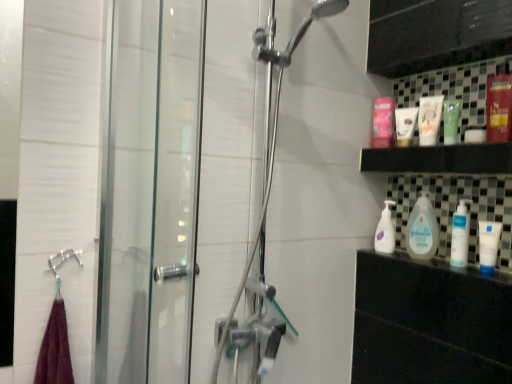
The width and height of the screenshot is (512, 384). Describe the element at coordinates (499, 107) in the screenshot. I see `metallic red mouthwash at upper right, arranged as the 1th mouthwash when viewed from the front` at that location.

The width and height of the screenshot is (512, 384). Identify the location of metallic red mouthwash at upper right, the fourth mouthwash in the back-to-front sequence. (499, 107).

Measure the distance between point (411, 109) and camera.

They are 4.66 feet apart.

The width and height of the screenshot is (512, 384). What do you see at coordinates (422, 229) in the screenshot? I see `white glossy baby lotion at center, positioned as the second cleaning product in front-to-back order` at bounding box center [422, 229].

What do you see at coordinates (385, 231) in the screenshot?
I see `white glossy mouthwash at right, the 2th mouthwash from the left` at bounding box center [385, 231].

Locate an element on the screen. white matte tube at right is located at coordinates [x=488, y=245].

What do you see at coordinates (460, 235) in the screenshot?
I see `white plastic pump bottle at lower right, which appears as the 1th cleaning product when viewed from the front` at bounding box center [460, 235].

Locate an element on the screen. Image resolution: width=512 pixels, height=384 pixels. metallic red mouthwash at upper right, arranged as the 4th mouthwash when viewed from the left is located at coordinates (499, 107).

Is white plastic pump bottle at lower right, the 2th cleaning product positioned from the back, wider than matte white lotion at upper right, arranged as the 2th toiletry when viewed from the back?

No, white plastic pump bottle at lower right, the 2th cleaning product positioned from the back, is not wider than matte white lotion at upper right, arranged as the 2th toiletry when viewed from the back.

Is white plastic pump bottle at lower right, the 2th cleaning product positioned from the back, positioned beyond the bounds of matte white lotion at upper right, arranged as the 2th toiletry when viewed from the back?

Yes, white plastic pump bottle at lower right, the 2th cleaning product positioned from the back, is outside of matte white lotion at upper right, arranged as the 2th toiletry when viewed from the back.

Based on the photo, from their relative heights in the image, would you say white plastic pump bottle at lower right, the 2th cleaning product positioned from the back, is taller or shorter than matte white lotion at upper right, which is the first toiletry from front to back?

Clearly, white plastic pump bottle at lower right, the 2th cleaning product positioned from the back, is taller compared to matte white lotion at upper right, which is the first toiletry from front to back.

How different are the orientations of white plastic pump bottle at lower right, which appears as the 1th cleaning product when viewed from the front, and matte white lotion at upper right, which is the first toiletry from front to back, in degrees?

The angular difference between white plastic pump bottle at lower right, which appears as the 1th cleaning product when viewed from the front, and matte white lotion at upper right, which is the first toiletry from front to back, is 0.00176 degrees.

Is white matte tube at right not within metallic red mouthwash at upper right, arranged as the 1th mouthwash when viewed from the front?

That's correct, white matte tube at right is outside of metallic red mouthwash at upper right, arranged as the 1th mouthwash when viewed from the front.

What's the angular difference between white matte tube at right and metallic red mouthwash at upper right, the first mouthwash positioned from the right,'s facing directions?

There is a 0.0035-degree angle between the facing directions of white matte tube at right and metallic red mouthwash at upper right, the first mouthwash positioned from the right.

From the picture: Is white matte tube at right to the left of metallic red mouthwash at upper right, arranged as the 4th mouthwash when viewed from the left, from the viewer's perspective?

Correct, you'll find white matte tube at right to the left of metallic red mouthwash at upper right, arranged as the 4th mouthwash when viewed from the left.

From a real-world perspective, which is physically above, white matte tube at right or metallic red mouthwash at upper right, the fourth mouthwash in the back-to-front sequence?

metallic red mouthwash at upper right, the fourth mouthwash in the back-to-front sequence, is physically above.

Which object is wider, white matte tube at right or white glossy baby lotion at center, which appears as the first cleaning product when viewed from the back?

white glossy baby lotion at center, which appears as the first cleaning product when viewed from the back, is wider.

From the image's perspective, who appears lower, white matte tube at right or white glossy baby lotion at center, which appears as the first cleaning product when viewed from the back?

white matte tube at right.

From a real-world perspective, which is physically above, white matte tube at right or white glossy baby lotion at center, positioned as the second cleaning product in front-to-back order?

white glossy baby lotion at center, positioned as the second cleaning product in front-to-back order, is physically above.

Can you tell me how much white matte tube at right and white glossy baby lotion at center, which appears as the first cleaning product when viewed from the back, differ in facing direction?

0.00129 degrees separate the facing orientations of white matte tube at right and white glossy baby lotion at center, which appears as the first cleaning product when viewed from the back.

Between white matte tube at right and white glossy mouthwash at right, the second mouthwash in the back-to-front sequence, which one appears on the left side from the viewer's perspective?

white glossy mouthwash at right, the second mouthwash in the back-to-front sequence.

Between white matte tube at right and white glossy mouthwash at right, the 2th mouthwash from the left, which one has larger width?

With larger width is white glossy mouthwash at right, the 2th mouthwash from the left.

Based on the photo, how much distance is there between white matte tube at right and white glossy mouthwash at right, the 2th mouthwash from the left?

white matte tube at right and white glossy mouthwash at right, the 2th mouthwash from the left, are 36.84 centimeters apart from each other.

Is white matte tube at right inside or outside of white glossy mouthwash at right, arranged as the 3th mouthwash when viewed from the right?

white matte tube at right is located beyond the bounds of white glossy mouthwash at right, arranged as the 3th mouthwash when viewed from the right.

From their relative heights in the image, would you say green matte tube at upper right, which is the third mouthwash from left to right, is taller or shorter than brushed metal towel ring at lower left?

green matte tube at upper right, which is the third mouthwash from left to right, is taller than brushed metal towel ring at lower left.

This screenshot has height=384, width=512. Find the location of `the 2nd mouthwash above the brushed metal towel ring at lower left (from a real-world perspective)`. the 2nd mouthwash above the brushed metal towel ring at lower left (from a real-world perspective) is located at coordinates (451, 120).

Is the surface of green matte tube at upper right, which is the third mouthwash from left to right, in direct contact with brushed metal towel ring at lower left?

No, green matte tube at upper right, which is the third mouthwash from left to right, is not with brushed metal towel ring at lower left.

Is brushed metal towel ring at lower left at the back of pink glossy mouthwash at upper right, the first mouthwash in the back-to-front sequence?

No, brushed metal towel ring at lower left is not at the back of pink glossy mouthwash at upper right, the first mouthwash in the back-to-front sequence.

Is the surface of pink glossy mouthwash at upper right, which is counted as the fourth mouthwash, starting from the right, in direct contact with brushed metal towel ring at lower left?

No, pink glossy mouthwash at upper right, which is counted as the fourth mouthwash, starting from the right, is not making contact with brushed metal towel ring at lower left.

Would you say pink glossy mouthwash at upper right, positioned as the 1th mouthwash in left-to-right order, contains brushed metal towel ring at lower left?

Definitely not — brushed metal towel ring at lower left is not inside pink glossy mouthwash at upper right, positioned as the 1th mouthwash in left-to-right order.

Between point (377, 104) and point (63, 262), which one is positioned behind?

Point (377, 104)

Is point (496, 120) positioned behind point (383, 217)?

That is False.

From a real-world perspective, is metallic red mouthwash at upper right, the fourth mouthwash in the back-to-front sequence, beneath white glossy mouthwash at right, the 2th mouthwash from the left?

No.

Find the location of `the 3rd mouthwash positioned above the white glossy mouthwash at right, arranged as the 3th mouthwash when viewed from the right (from a real-world perspective)`. the 3rd mouthwash positioned above the white glossy mouthwash at right, arranged as the 3th mouthwash when viewed from the right (from a real-world perspective) is located at coordinates (499, 107).

Is metallic red mouthwash at upper right, arranged as the 4th mouthwash when viewed from the left, to the left or to the right of white glossy mouthwash at right, acting as the third mouthwash starting from the front, in the image?

From the image, it's evident that metallic red mouthwash at upper right, arranged as the 4th mouthwash when viewed from the left, is to the right of white glossy mouthwash at right, acting as the third mouthwash starting from the front.

Where is `cleaning product located on the right of matte white lotion at upper right, which is the first toiletry from front to back`? Image resolution: width=512 pixels, height=384 pixels. cleaning product located on the right of matte white lotion at upper right, which is the first toiletry from front to back is located at coordinates (460, 235).

This screenshot has width=512, height=384. Find the location of `toothpaste on the left of metallic red mouthwash at upper right, the fourth mouthwash in the back-to-front sequence`. toothpaste on the left of metallic red mouthwash at upper right, the fourth mouthwash in the back-to-front sequence is located at coordinates (488, 245).

Estimate the real-world distances between objects in this image. Which object is closer to metallic red mouthwash at upper right, arranged as the 1th mouthwash when viewed from the front, white matte tube at right or brushed metal towel ring at lower left?

Among the two, white matte tube at right is located nearer to metallic red mouthwash at upper right, arranged as the 1th mouthwash when viewed from the front.

Based on their spatial positions, is brushed metal towel ring at lower left or white glossy mouthwash at right, the 2th mouthwash from the left, further from pink glossy mouthwash at upper right, which is counted as the fourth mouthwash, starting from the right?

brushed metal towel ring at lower left lies further to pink glossy mouthwash at upper right, which is counted as the fourth mouthwash, starting from the right, than the other object.

Considering their positions, is white matte tube at right positioned closer to brushed metal towel ring at lower left than green matte tube at upper right, which is the third mouthwash from left to right?

white matte tube at right is closer to brushed metal towel ring at lower left.

Looking at the image, which one is located closer to white glossy baby lotion at center, which appears as the first cleaning product when viewed from the back, matte white lotion at upper right, which is the first toiletry from front to back, or green matte tube at upper right, which is the third mouthwash from left to right?

Based on the image, matte white lotion at upper right, which is the first toiletry from front to back, appears to be nearer to white glossy baby lotion at center, which appears as the first cleaning product when viewed from the back.

Which object lies further to the anchor point brushed metal towel ring at lower left, white glossy mouthwash at right, the second mouthwash in the back-to-front sequence, or white plastic pump bottle at lower right, the 2th cleaning product positioned from the back?

white plastic pump bottle at lower right, the 2th cleaning product positioned from the back, lies further to brushed metal towel ring at lower left than the other object.

Based on their spatial positions, is green matte tube at upper right, which is the third mouthwash from left to right, or brushed metal towel ring at lower left further from white matte tube at right?

brushed metal towel ring at lower left lies further to white matte tube at right than the other object.

When comparing their distances from metallic red mouthwash at upper right, arranged as the 4th mouthwash when viewed from the left, does white glossy mouthwash at right, the 2th mouthwash from the left, or pink glossy mouthwash at upper right, the first mouthwash in the back-to-front sequence, seem further?

Based on the image, white glossy mouthwash at right, the 2th mouthwash from the left, appears to be further to metallic red mouthwash at upper right, arranged as the 4th mouthwash when viewed from the left.

Considering their positions, is white plastic pump bottle at lower right, the 2th cleaning product positioned from the back, positioned further to brushed metal towel ring at lower left than matte white lotion at upper right, which is the first toiletry from front to back?

Based on the image, matte white lotion at upper right, which is the first toiletry from front to back, appears to be further to brushed metal towel ring at lower left.

Identify the location of cleaning product between brushed metal towel ring at lower left and white plastic pump bottle at lower right, the 2th cleaning product positioned from the back, from left to right. (422, 229).

You are a GUI agent. You are given a task and a screenshot of the screen. Output one action in this format:
    pyautogui.click(x=<x>, y=<y>)
    Task: Click on the mouthwash between metallic red mouthwash at upper right, arranged as the 4th mouthwash when viewed from the left, and white glossy baby lotion at center, positioned as the second cleaning product in front-to-back order, from top to bottom
    
    Given the screenshot: What is the action you would take?
    pyautogui.click(x=451, y=120)

This screenshot has width=512, height=384. I want to click on mouthwash between metallic red mouthwash at upper right, arranged as the 4th mouthwash when viewed from the left, and matte white lotion at upper right, which is the first toiletry from front to back, from front to back, so [451, 120].

This screenshot has width=512, height=384. Find the location of `toiletry between matte white lotion at upper right, arranged as the 2th toiletry when viewed from the back, and white plastic pump bottle at lower right, which appears as the 1th cleaning product when viewed from the front, from top to bottom`. toiletry between matte white lotion at upper right, arranged as the 2th toiletry when viewed from the back, and white plastic pump bottle at lower right, which appears as the 1th cleaning product when viewed from the front, from top to bottom is located at coordinates (405, 125).